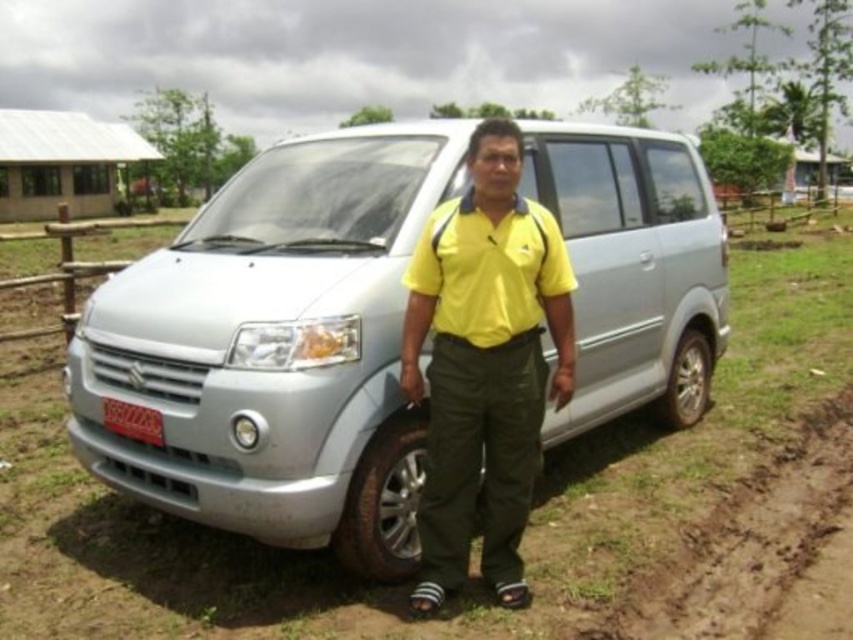
Who is higher up, yellow matte/polo shirt at center or black rubber tire at lower center?

yellow matte/polo shirt at center is above.

In the scene shown: Can you confirm if yellow matte/polo shirt at center is bigger than black rubber tire at lower center?

Yes.

Identify the location of yellow matte/polo shirt at center. The image size is (853, 640). (488, 268).

Which is more to the left, black rubber tire at lower center or silver metallic tire at lower right?

Positioned to the left is black rubber tire at lower center.

In the scene shown: Is black rubber tire at lower center thinner than silver metallic tire at lower right?

Indeed, black rubber tire at lower center has a lesser width compared to silver metallic tire at lower right.

Who is more distant from viewer, (354,476) or (699,353)?

Point (699,353)

The width and height of the screenshot is (853, 640). I want to click on black rubber tire at lower center, so click(x=386, y=500).

Does silver metallic van at center appear on the right side of silver metallic tire at lower right?

In fact, silver metallic van at center is to the left of silver metallic tire at lower right.

Can you confirm if silver metallic van at center is positioned below silver metallic tire at lower right?

Actually, silver metallic van at center is above silver metallic tire at lower right.

Does point (250, 401) lie in front of point (671, 378)?

Yes.

The image size is (853, 640). Identify the location of silver metallic van at center. (276, 349).